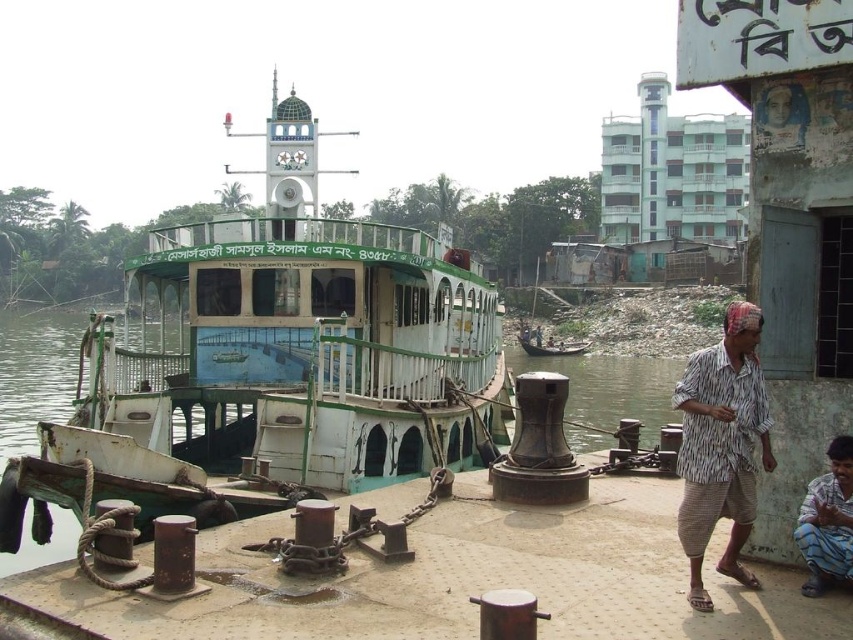
Question: Can you confirm if green painted wood boat at center is wider than striped fabric shirt at lower right?

Choices:
 (A) no
 (B) yes

Answer: (B)

Question: Which of the following is the closest to the observer?

Choices:
 (A) blue striped shirt at lower right
 (B) striped fabric shirt at lower right

Answer: (B)

Question: Which point is closer to the camera?

Choices:
 (A) blue striped shirt at lower right
 (B) wooden boat at center

Answer: (A)

Question: Is striped fabric shirt at lower right positioned in front of blue striped shirt at lower right?

Choices:
 (A) no
 (B) yes

Answer: (B)

Question: Is striped fabric shirt at lower right below wooden boat at center?

Choices:
 (A) yes
 (B) no

Answer: (B)

Question: Among these objects, which one is farthest from the camera?

Choices:
 (A) wooden boat at center
 (B) blue striped shirt at lower right

Answer: (A)